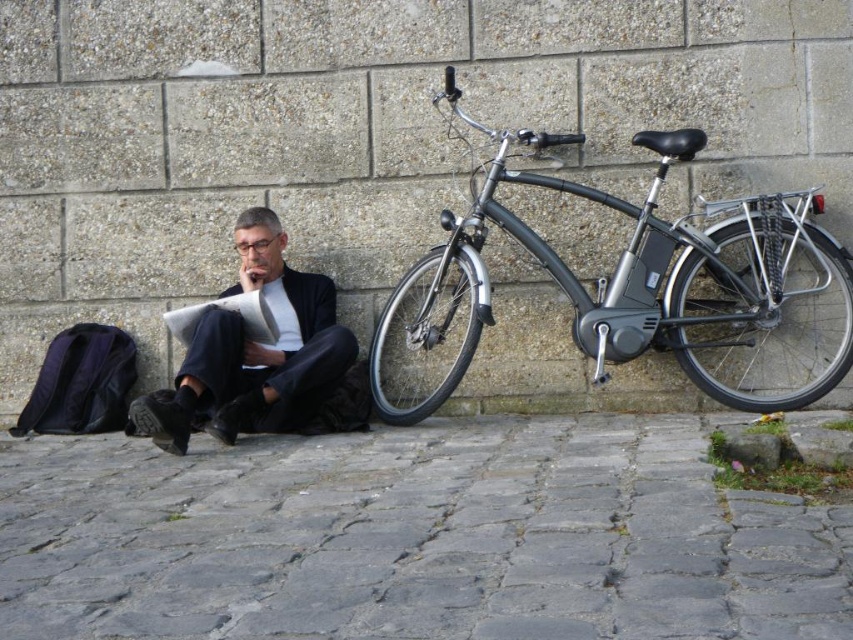
You are standing in front of the stone wall and want to place a small potted plant between the shiny metallic bicycle at right and the black fabric suit at center. Based on their positions, which object should the plant be closer to?

Answer: The shiny metallic bicycle at right is closer to the viewer than the black fabric suit at center, so the plant should be placed closer to the shiny metallic bicycle at right to maintain a balanced distance between both objects.

You are standing in front of the stone wall and want to place a small potted plant between the shiny metallic bicycle at right and the black fabric suit at center. According to the scene description, where should you position the potted plant?

The shiny metallic bicycle at right is above the black fabric suit at center, so you should place the potted plant between them along the vertical axis, positioning it below the bicycle and above the black fabric suit at center.